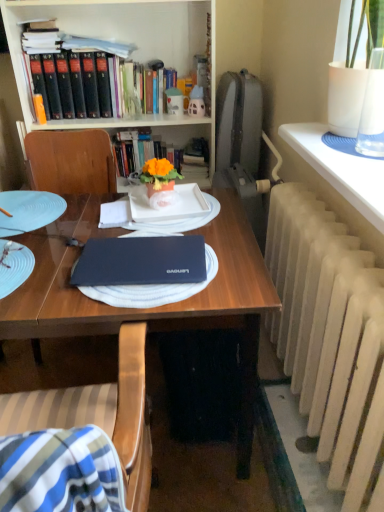
Find the location of a particular element. free spot above white matte plate at center (from a real-world perspective) is located at coordinates (165, 210).